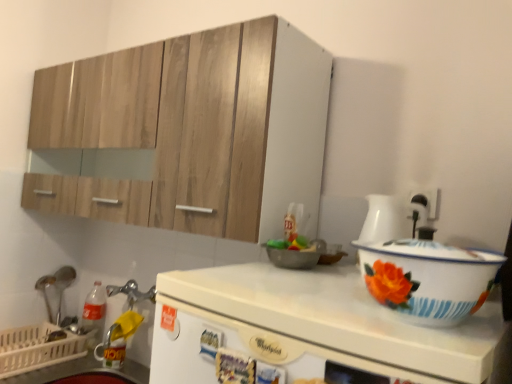
Question: Is brushed metal spoon at left closer to camera compared to white glossy counter top at lower left?

Choices:
 (A) yes
 (B) no

Answer: (B)

Question: Is brushed metal spoon at left taller than white glossy counter top at lower left?

Choices:
 (A) yes
 (B) no

Answer: (A)

Question: Could you tell me if brushed metal spoon at left is facing white glossy counter top at lower left?

Choices:
 (A) yes
 (B) no

Answer: (B)

Question: Does brushed metal spoon at left appear on the left side of white glossy counter top at lower left?

Choices:
 (A) yes
 (B) no

Answer: (A)

Question: Does brushed metal spoon at left have a lesser height compared to white glossy counter top at lower left?

Choices:
 (A) no
 (B) yes

Answer: (A)

Question: From the image's perspective, is white glossy whirlpool at center positioned above or below wooden cabinet at upper left?

Choices:
 (A) below
 (B) above

Answer: (A)

Question: Considering the positions of white glossy whirlpool at center and wooden cabinet at upper left in the image, is white glossy whirlpool at center wider or thinner than wooden cabinet at upper left?

Choices:
 (A) wide
 (B) thin

Answer: (B)

Question: Is point (348, 322) positioned closer to the camera than point (256, 152)?

Choices:
 (A) farther
 (B) closer

Answer: (B)

Question: Would you say white glossy whirlpool at center is to the left or to the right of wooden cabinet at upper left in the picture?

Choices:
 (A) right
 (B) left

Answer: (A)

Question: Relative to wooden cabinet at upper left, is white enamel basin at right in front or behind?

Choices:
 (A) behind
 (B) front

Answer: (B)

Question: Looking at their shapes, would you say white enamel basin at right is wider or thinner than wooden cabinet at upper left?

Choices:
 (A) wide
 (B) thin

Answer: (B)

Question: Choose the correct answer: Is white enamel basin at right inside wooden cabinet at upper left or outside it?

Choices:
 (A) inside
 (B) outside

Answer: (B)

Question: From the image's perspective, is white enamel basin at right positioned above or below wooden cabinet at upper left?

Choices:
 (A) below
 (B) above

Answer: (A)

Question: Is white enamel basin at right bigger or smaller than white glossy whirlpool at center?

Choices:
 (A) big
 (B) small

Answer: (A)

Question: Is white enamel basin at right wider or thinner than white glossy whirlpool at center?

Choices:
 (A) wide
 (B) thin

Answer: (A)